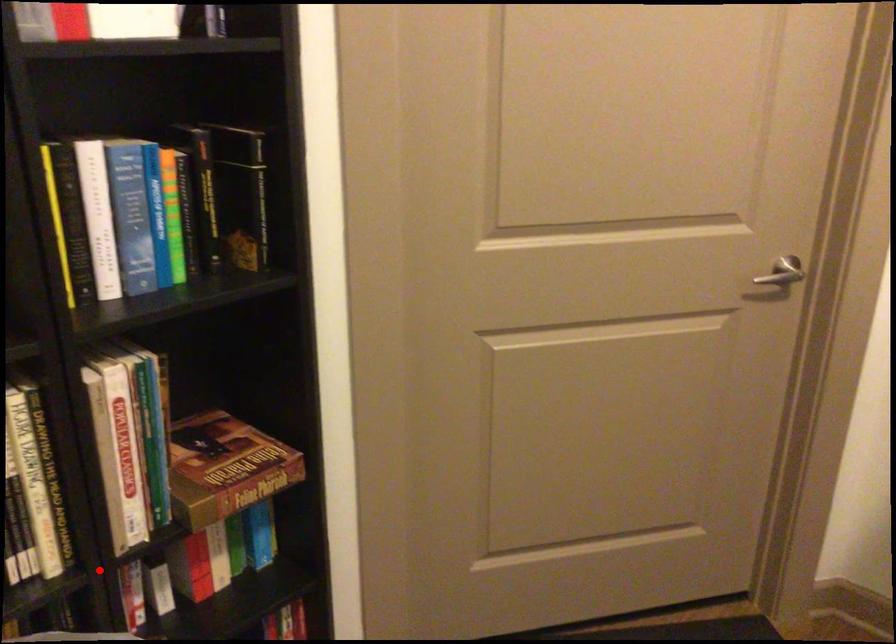
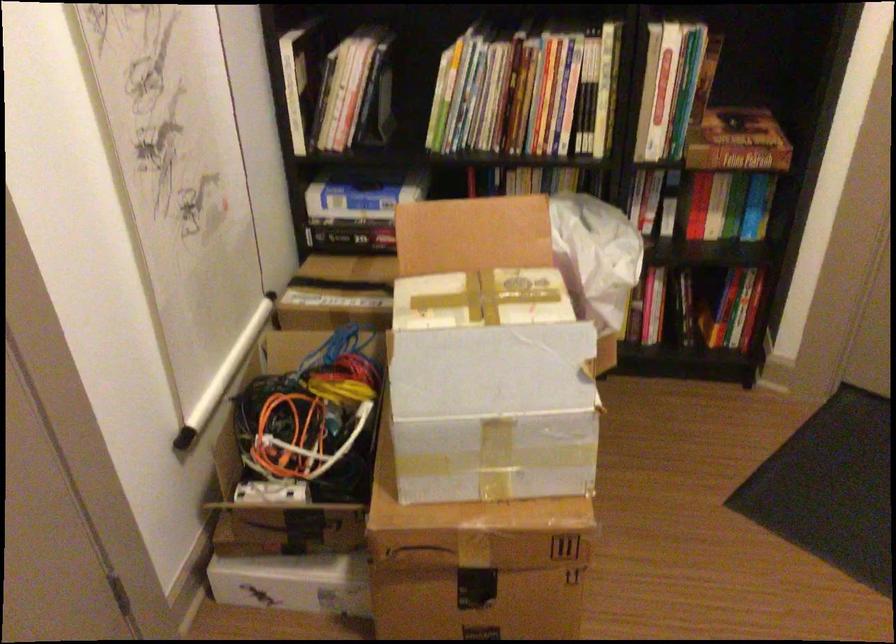
Question: I am providing you with two images of the same scene from different viewpoints. In image1, a red point is highlighted. Considering the same 3D point in image2, which of the following is correct?

Choices:
 (A) It is closer
 (B) It is farther

Answer: (B)